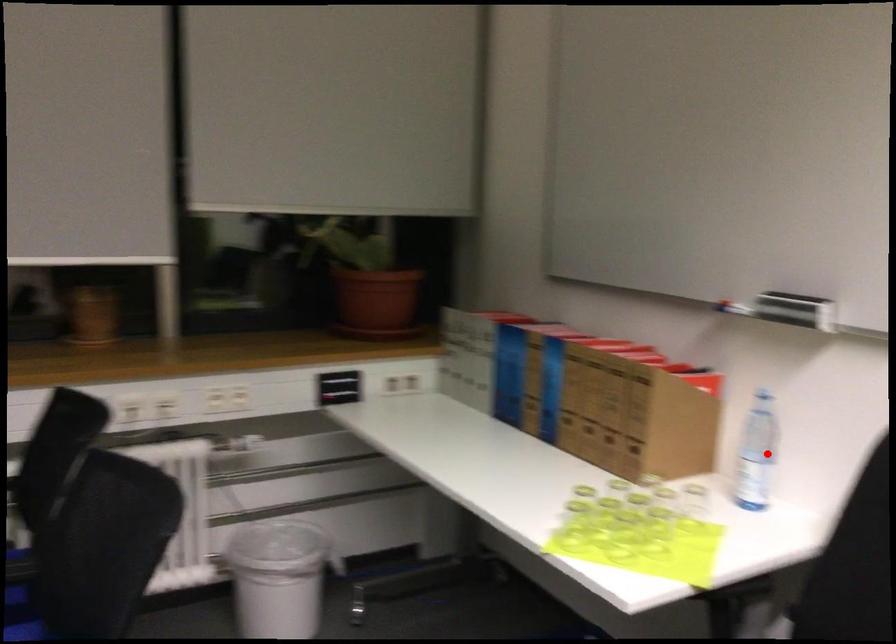
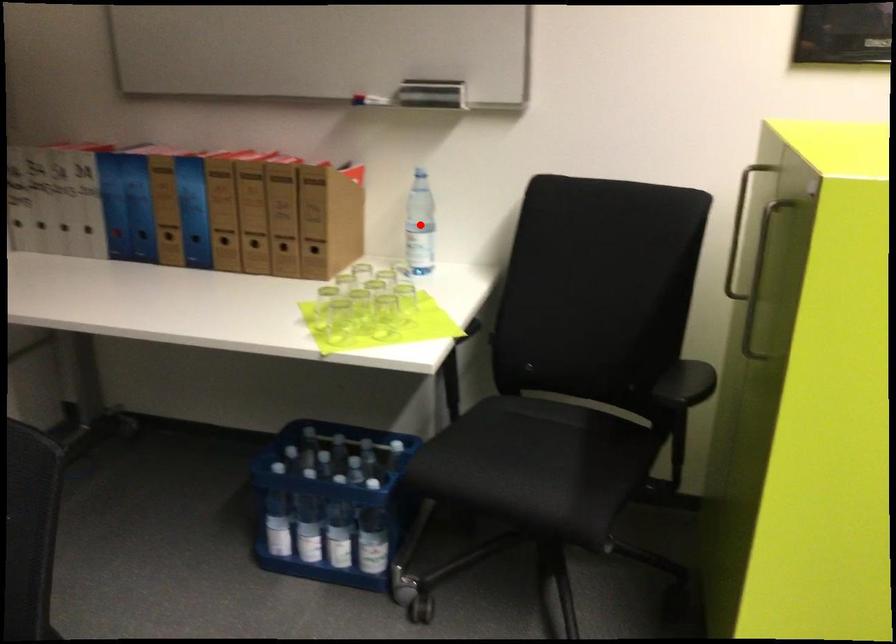
I am providing you with two images of the same scene from different viewpoints. A red point is marked on the first image and another point is marked on the second image. Is the marked point in image1 the same physical position as the marked point in image2?

Yes